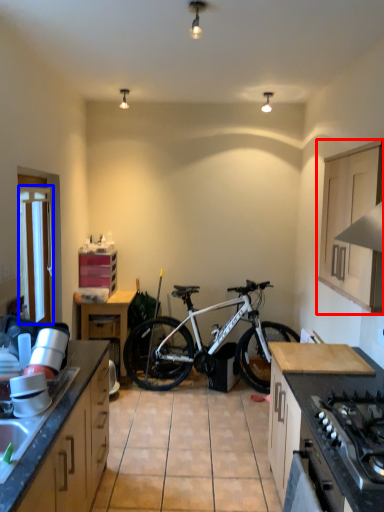
Question: Which object appears farthest to the camera in this image, cabinetry (highlighted by a red box) or window screen (highlighted by a blue box)?

Choices:
 (A) cabinetry
 (B) window screen

Answer: (B)